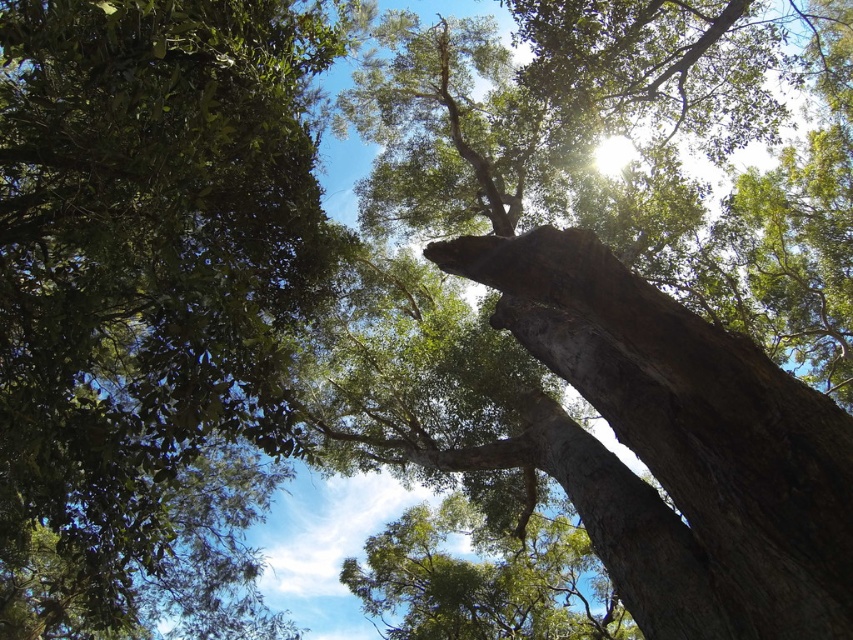
Question: Considering the relative positions of green leafy tree at upper left and green rough bark tree at center in the image provided, where is green leafy tree at upper left located with respect to green rough bark tree at center?

Choices:
 (A) above
 (B) below

Answer: (A)

Question: Does green leafy tree at upper left appear on the right side of green rough bark tree at center?

Choices:
 (A) no
 (B) yes

Answer: (B)

Question: Can you confirm if green leafy tree at upper left is thinner than green rough bark tree at center?

Choices:
 (A) no
 (B) yes

Answer: (A)

Question: Among these points, which one is farthest from the camera?

Choices:
 (A) (83, 554)
 (B) (566, 611)

Answer: (B)